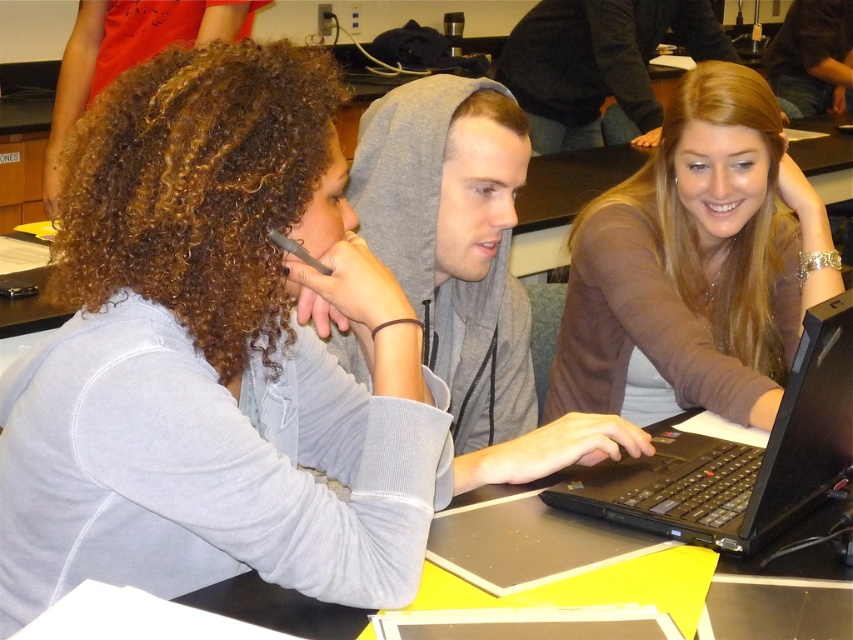
Question: Estimate the real-world distances between objects in this image. Which object is closer to the yellow plastic table at center?

Choices:
 (A) black matte laptop at lower right
 (B) matte brown sweater at center
 (C) gray hoodie at center

Answer: (B)

Question: Is black matte laptop at lower right bigger than yellow plastic table at center?

Choices:
 (A) no
 (B) yes

Answer: (A)

Question: Which point appears farthest from the camera in this image?

Choices:
 (A) (717, 397)
 (B) (337, 340)

Answer: (A)

Question: Is matte brown sweater at center below gray hoodie at center?

Choices:
 (A) no
 (B) yes

Answer: (A)

Question: Estimate the real-world distances between objects in this image. Which object is farther from the gray hoodie at center?

Choices:
 (A) yellow plastic table at center
 (B) matte brown sweater at center

Answer: (A)

Question: Is the position of gray hoodie at center less distant than that of yellow plastic table at center?

Choices:
 (A) yes
 (B) no

Answer: (A)